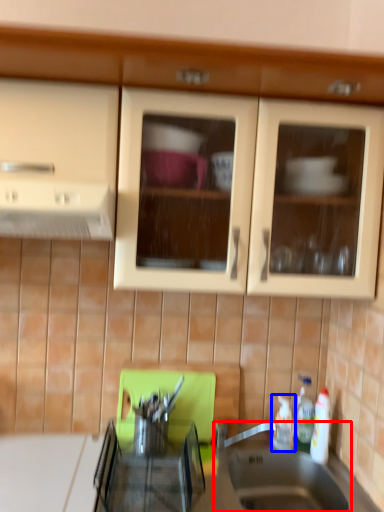
Question: Among these objects, which one is nearest to the camera, sink (highlighted by a red box) or bottle (highlighted by a blue box)?

Choices:
 (A) sink
 (B) bottle

Answer: (A)